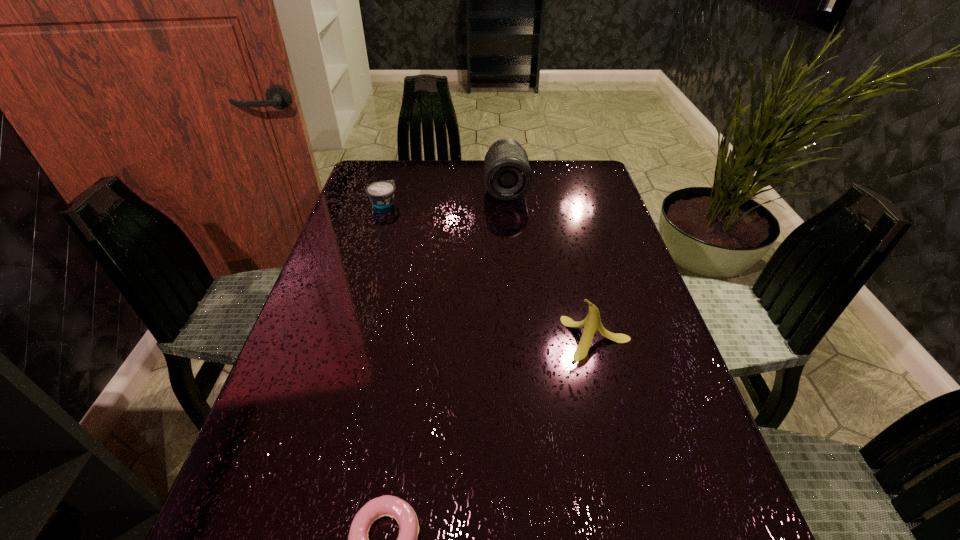
You are a GUI agent. You are given a task and a screenshot of the screen. Output one action in this format:
    pyautogui.click(x=<x>, y=<y>)
    Task: Click on the yogurt located in the far edge section of the desktop
    This screenshot has height=540, width=960.
    Given the screenshot: What is the action you would take?
    pyautogui.click(x=381, y=194)

At what (x,y) coordinates should I click in order to perform the action: click on object that is positioned at the left edge. Please return your answer as a coordinate pair (x, y). This screenshot has height=540, width=960. Looking at the image, I should click on (381, 194).

Locate an element on the screen. Image resolution: width=960 pixels, height=540 pixels. object present at the right edge is located at coordinates (592, 322).

What are the coordinates of `object located at the far left corner` in the screenshot? It's located at (381, 194).

The height and width of the screenshot is (540, 960). What are the coordinates of `vacant space at the far edge of the desktop` in the screenshot? It's located at point(462,172).

Image resolution: width=960 pixels, height=540 pixels. I want to click on vacant space at the left edge of the desktop, so click(295, 397).

At what (x,y) coordinates should I click in order to perform the action: click on free space at the right edge of the desktop. Please return your answer as a coordinate pair (x, y). Looking at the image, I should click on (616, 265).

The image size is (960, 540). I want to click on free space at the far left corner of the desktop, so click(x=374, y=162).

The image size is (960, 540). Identify the location of vacant space at the far right corner of the desktop. (557, 193).

You are a GUI agent. You are given a task and a screenshot of the screen. Output one action in this format:
    pyautogui.click(x=<x>, y=<y>)
    Task: Click on the vacant space that is in between the yogurt and the telephoto lens
    The height and width of the screenshot is (540, 960).
    Given the screenshot: What is the action you would take?
    pyautogui.click(x=444, y=195)